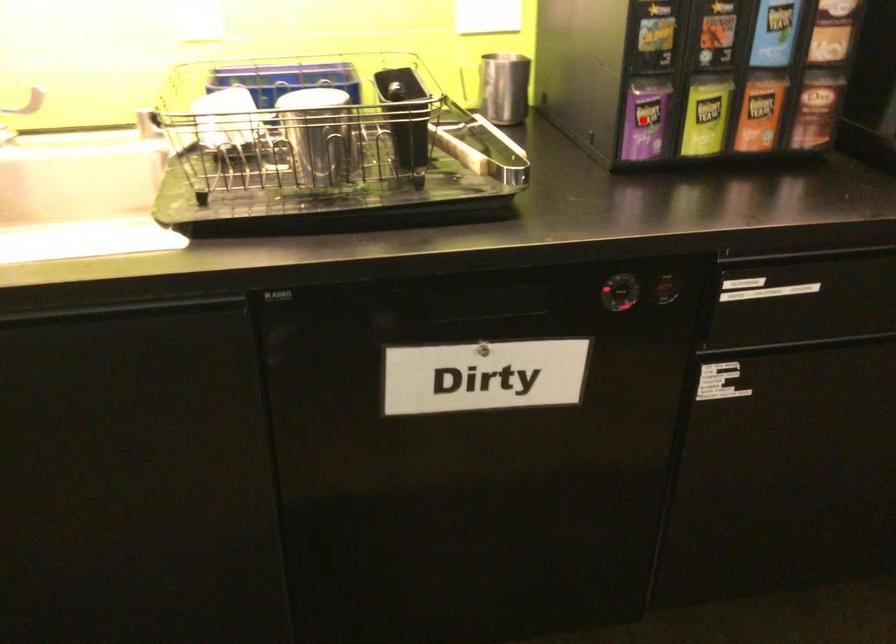
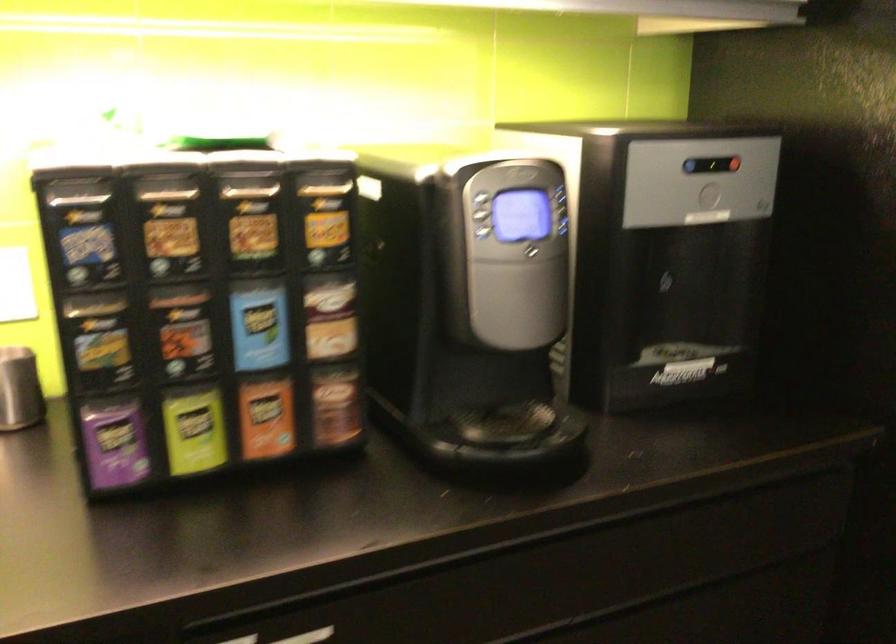
The point at the highlighted location is marked in the first image. Where is the corresponding point in the second image?

(114, 442)